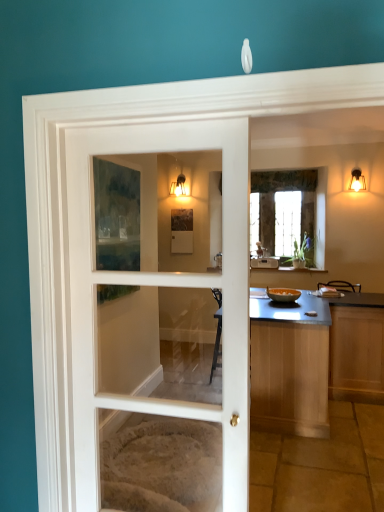
Question: Is white glass door at center far away from matte glass sconce at upper center, arranged as the 1th light fixture when viewed from the back?

Choices:
 (A) yes
 (B) no

Answer: (A)

Question: Is white glass door at center at the right side of matte glass sconce at upper center, which is the second light fixture in right-to-left order?

Choices:
 (A) yes
 (B) no

Answer: (A)

Question: Considering the relative sizes of white glass door at center and matte glass sconce at upper center, the 1th light fixture in the left-to-right sequence, in the image provided, is white glass door at center shorter than matte glass sconce at upper center, the 1th light fixture in the left-to-right sequence,?

Choices:
 (A) no
 (B) yes

Answer: (A)

Question: Is white glass door at center taller than matte glass sconce at upper center, the 1th light fixture in the left-to-right sequence?

Choices:
 (A) yes
 (B) no

Answer: (A)

Question: From a real-world perspective, does white glass door at center sit lower than matte glass sconce at upper center, which is the second light fixture in right-to-left order?

Choices:
 (A) yes
 (B) no

Answer: (A)

Question: Are white glass door at center and matte glass sconce at upper center, arranged as the 1th light fixture when viewed from the back, making contact?

Choices:
 (A) yes
 (B) no

Answer: (B)

Question: Is matte glass sconce at upper center, the 1th light fixture in the left-to-right sequence, aimed at matte gold light fixture at upper right, the 1th light fixture positioned from the front?

Choices:
 (A) no
 (B) yes

Answer: (A)

Question: Considering the relative sizes of matte glass sconce at upper center, arranged as the 1th light fixture when viewed from the back, and matte gold light fixture at upper right, the 1th light fixture positioned from the front, in the image provided, is matte glass sconce at upper center, arranged as the 1th light fixture when viewed from the back, taller than matte gold light fixture at upper right, the 1th light fixture positioned from the front,?

Choices:
 (A) yes
 (B) no

Answer: (A)

Question: Is matte glass sconce at upper center, the 1th light fixture in the left-to-right sequence, oriented away from matte gold light fixture at upper right, which is the 2th light fixture from left to right?

Choices:
 (A) yes
 (B) no

Answer: (B)

Question: Can you confirm if matte glass sconce at upper center, acting as the 2th light fixture starting from the front, is positioned to the right of matte gold light fixture at upper right, the 1th light fixture positioned from the front?

Choices:
 (A) no
 (B) yes

Answer: (A)

Question: From the image's perspective, is matte glass sconce at upper center, which is the second light fixture in right-to-left order, located beneath matte gold light fixture at upper right, which is the 2th light fixture from left to right?

Choices:
 (A) no
 (B) yes

Answer: (A)

Question: Does matte glass sconce at upper center, arranged as the 1th light fixture when viewed from the back, have a lesser width compared to matte gold light fixture at upper right, which is the 2th light fixture from left to right?

Choices:
 (A) yes
 (B) no

Answer: (A)

Question: Is matte glass sconce at upper center, acting as the 2th light fixture starting from the front, positioned far away from white glass door at center?

Choices:
 (A) yes
 (B) no

Answer: (A)